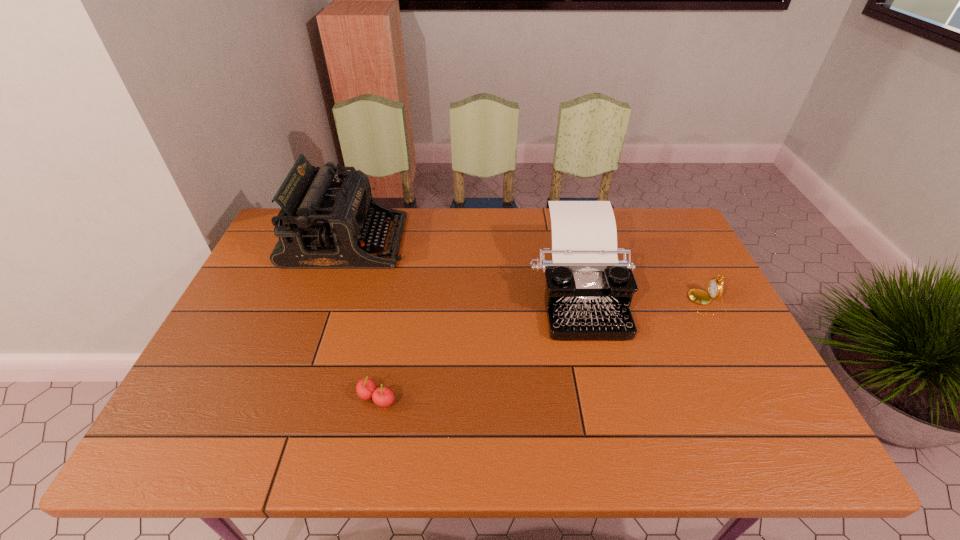
Where is `object that stands as the third closest to the third object from left to right`? Image resolution: width=960 pixels, height=540 pixels. object that stands as the third closest to the third object from left to right is located at coordinates (323, 224).

Select which object appears as the second closest to the pocket watch. Please provide its 2D coordinates. Your answer should be formatted as a tuple, i.e. [(x, y)], where the tuple contains the x and y coordinates of a point satisfying the conditions above.

[(366, 389)]

The width and height of the screenshot is (960, 540). Identify the location of vacant region that satisfies the following two spatial constraints: 1. on the keyboard of the cherry; 2. on the left side of the tallest object. (291, 399).

I want to click on vacant space that satisfies the following two spatial constraints: 1. on the keyboard of the taller typewriter; 2. on the left side of the shortest object, so 291,399.

Locate an element on the screen. The width and height of the screenshot is (960, 540). vacant point that satisfies the following two spatial constraints: 1. on the keyboard of the left typewriter; 2. on the back side of the nearest object is located at coordinates (291, 399).

Identify the location of free location that satisfies the following two spatial constraints: 1. on the back side of the nearest object; 2. on the keyboard of the taller typewriter. Image resolution: width=960 pixels, height=540 pixels. (407, 241).

The height and width of the screenshot is (540, 960). Identify the location of vacant area in the image that satisfies the following two spatial constraints: 1. on the keyboard of the tallest object; 2. on the left side of the shortest object. (291, 399).